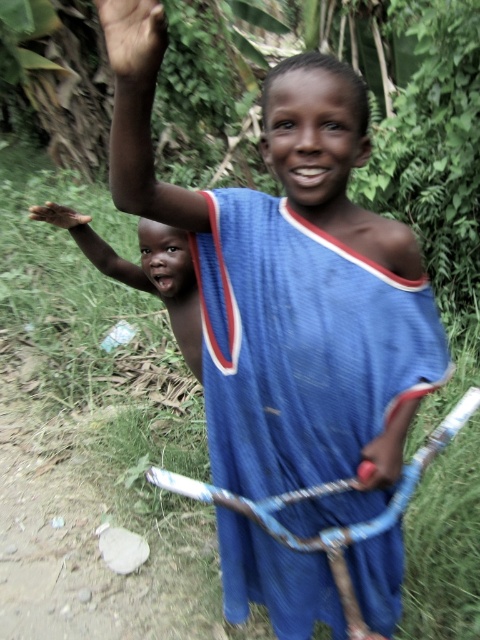
Question: Considering the real-world distances, which object is closest to the brown skin at upper left?

Choices:
 (A) brown skin hand at upper left
 (B) smooth skin child at left
 (C) blue jersey at center

Answer: (C)

Question: Can you confirm if blue jersey at center is positioned below brown skin at upper left?

Choices:
 (A) yes
 (B) no

Answer: (A)

Question: Which of the following is the farthest from the observer?

Choices:
 (A) pos(57,221)
 (B) pos(369,444)
 (C) pos(152,3)
 (D) pos(360,492)

Answer: (A)

Question: In this image, where is blue jersey at center located relative to smooth skin child at left?

Choices:
 (A) below
 (B) above

Answer: (A)

Question: Does blue jersey at center have a smaller size compared to smooth skin child at left?

Choices:
 (A) yes
 (B) no

Answer: (B)

Question: Which object is positioned closest to the brown skin at upper left?

Choices:
 (A) brown skin hand at upper left
 (B) blue jersey at center
 (C) smooth plastic handle at lower right

Answer: (C)